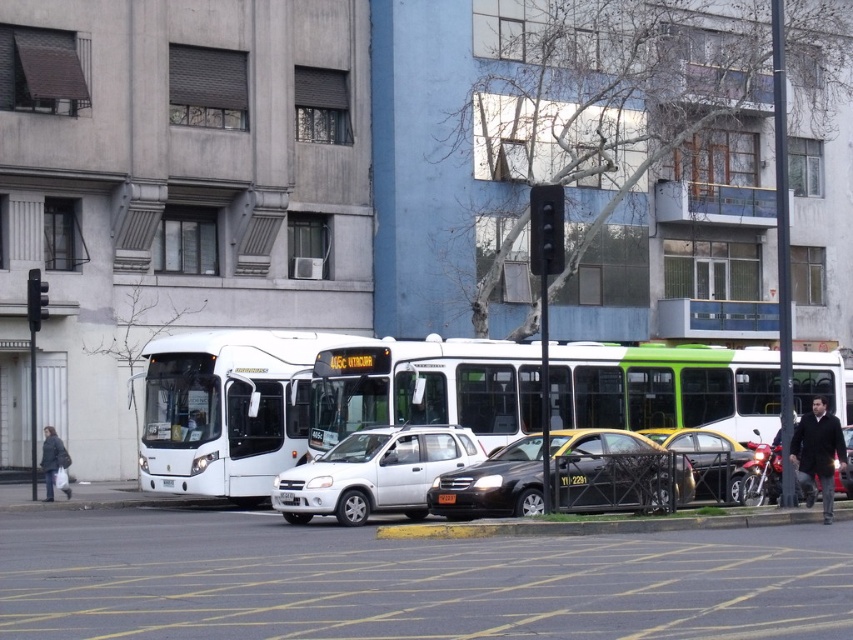
Question: Estimate the real-world distances between objects in this image. Which object is farther from the black asphalt curb at lower center?

Choices:
 (A) white matte bus at center
 (B) black matte taxi at center

Answer: (A)

Question: Does shiny black sedan at center appear on the right side of metallic silver car at right?

Choices:
 (A) no
 (B) yes

Answer: (A)

Question: Which of these objects is positioned closest to the black matte taxi at center?

Choices:
 (A) black asphalt curb at lower center
 (B) metallic silver car at right
 (C) white matte bus at center

Answer: (A)

Question: Is white matte car at center behind shiny black sedan at center?

Choices:
 (A) yes
 (B) no

Answer: (B)

Question: In this image, where is white matte bus at center located relative to metallic silver car at right?

Choices:
 (A) left
 (B) right

Answer: (A)

Question: Which object is the farthest from the white matte car at center?

Choices:
 (A) shiny black sedan at center
 (B) white matte bus at center
 (C) black matte taxi at center

Answer: (A)